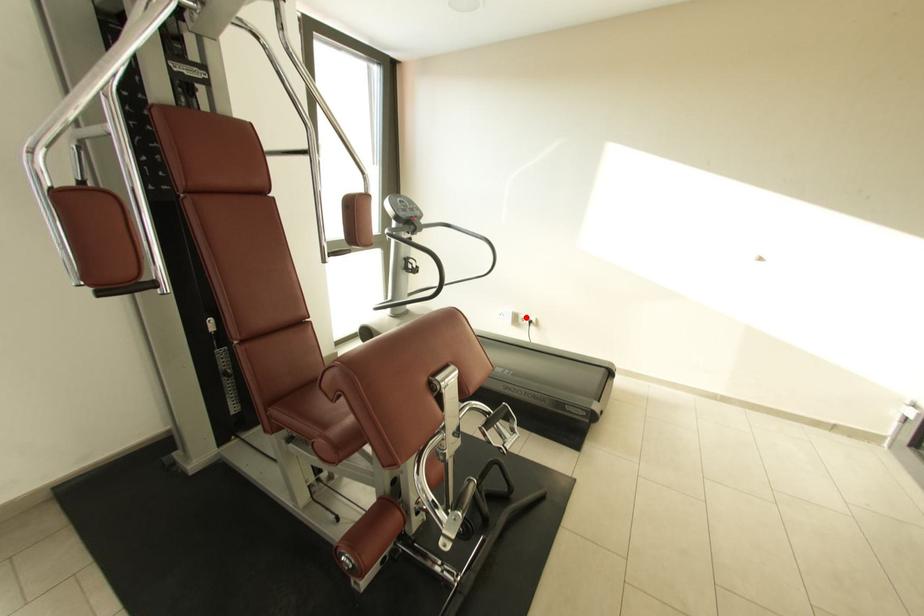
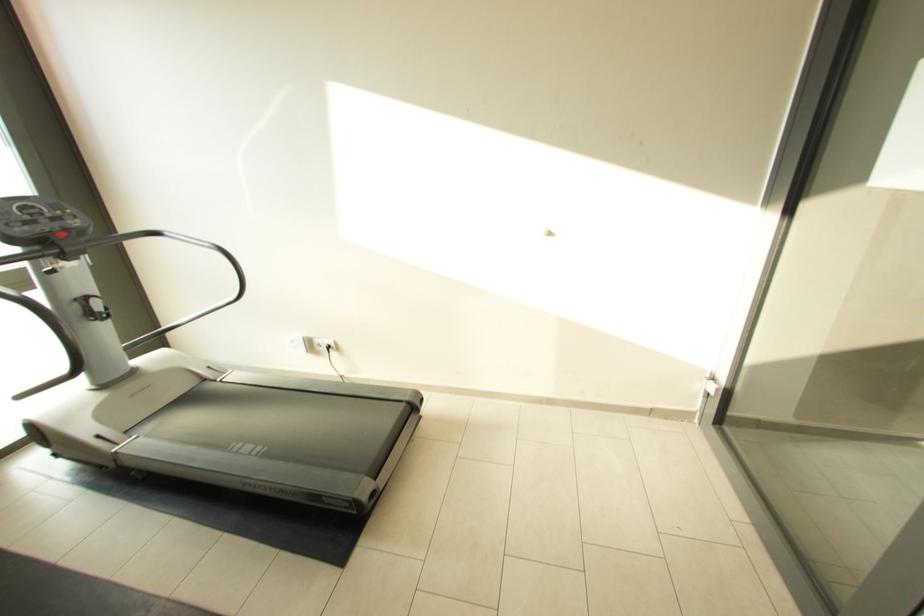
Question: I am providing you with two images of the same scene from different viewpoints. Image1 has a red point marked. In image2, the corresponding 3D location appears at what relative position? Reply with the corresponding letter.

Choices:
 (A) Closer
 (B) Farther

Answer: (B)